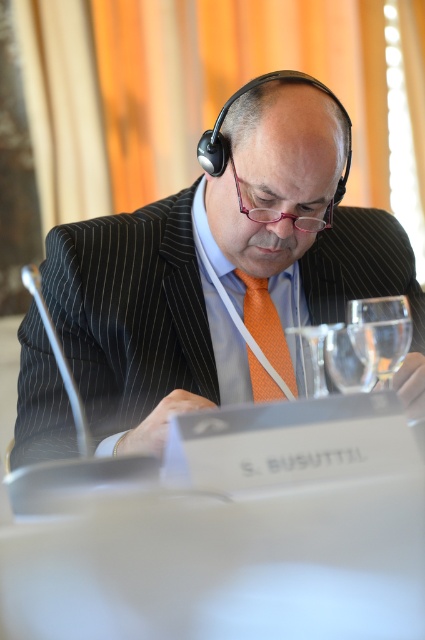
You are a server at a restaurant and need to place a new wine glass on the table. The table already has a transparent glass at right and a clear glass wine glass at center. Where should you place the new wine glass to avoid covering any existing glasses?

You should place the new wine glass somewhere other than the right side or center of the table since the transparent glass at right is already positioned over the clear glass wine glass at center, meaning those spots are occupied.

You are attending a virtual meeting and need to identify the speaker based on their clothing. The speaker is wearing a matte black suit at center and an orange textured tie at center. Which clothing item is closer to you visually?

The matte black suit at center is closer to the viewer than the orange textured tie at center.